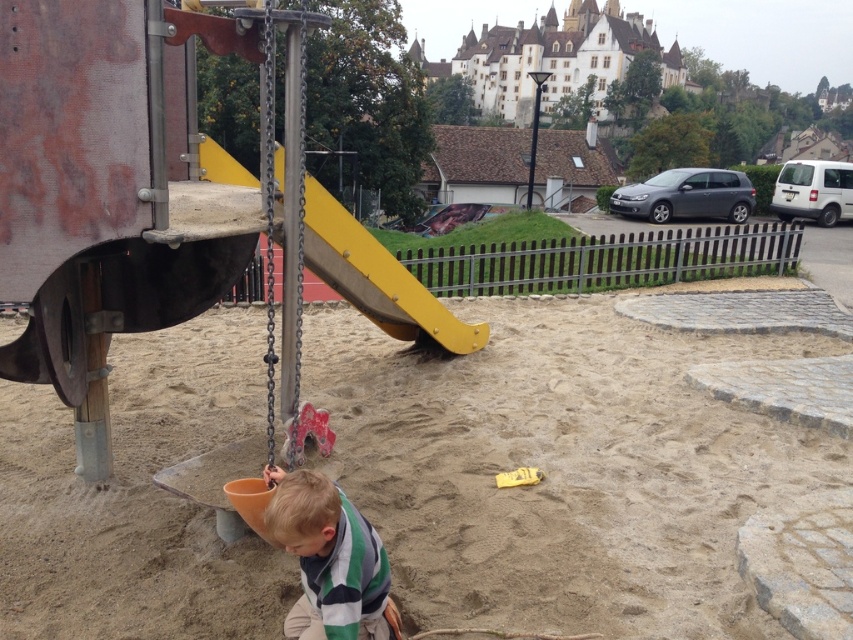
Question: Does fine-grained sand at center have a greater width compared to green striped shirt at center?

Choices:
 (A) yes
 (B) no

Answer: (A)

Question: Which point is farther from the camera taking this photo?

Choices:
 (A) pos(381,547)
 (B) pos(703,628)

Answer: (B)

Question: Which object is farther from the camera taking this photo?

Choices:
 (A) green striped shirt at center
 (B) fine-grained sand at center
 (C) yellow matte slide at center

Answer: (C)

Question: Is fine-grained sand at center thinner than green striped shirt at center?

Choices:
 (A) yes
 (B) no

Answer: (B)

Question: Does green striped shirt at center have a greater width compared to yellow matte slide at center?

Choices:
 (A) no
 (B) yes

Answer: (B)

Question: Which object is positioned closest to the fine-grained sand at center?

Choices:
 (A) yellow matte slide at center
 (B) green striped shirt at center

Answer: (A)